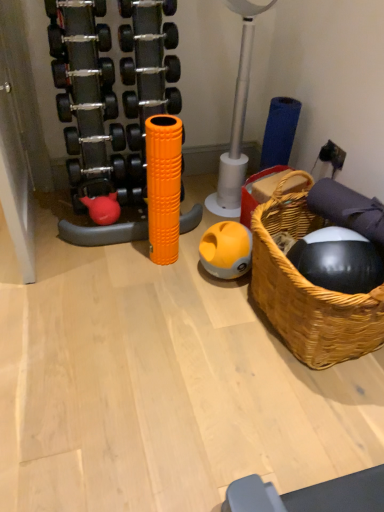
Find the location of a particular element. free space behind orange foam roller at center is located at coordinates (188, 233).